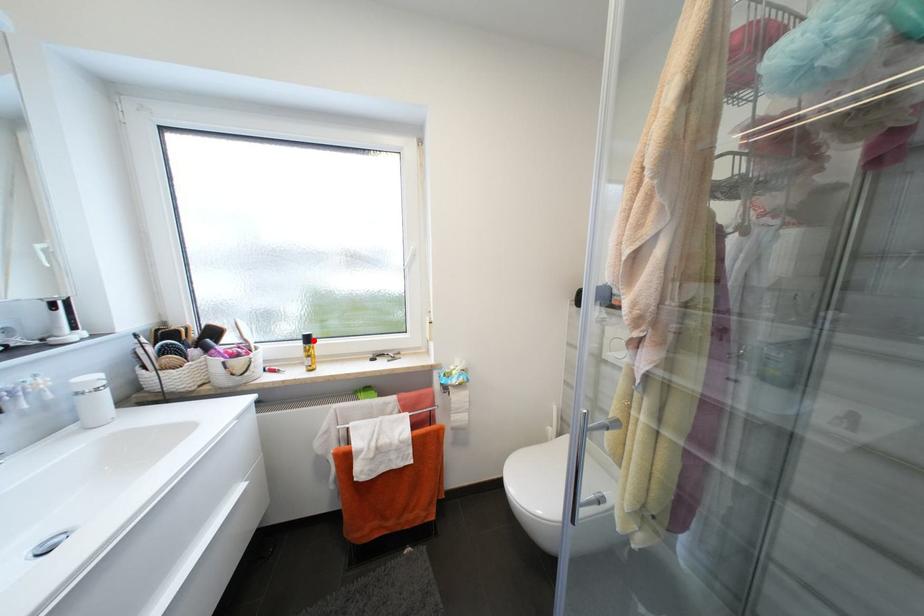
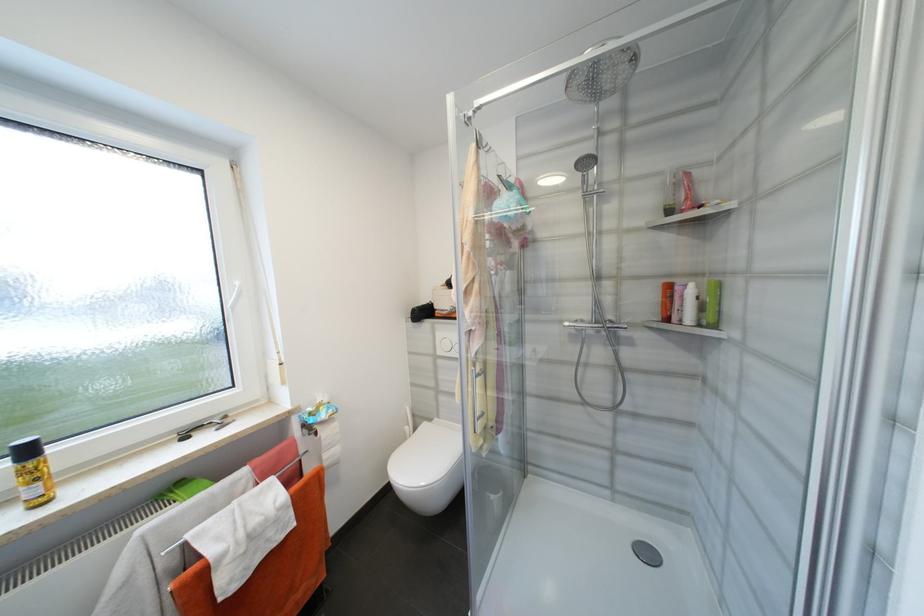
In the second image, find the point that corresponds to the highlighted location in the first image.

(33, 453)